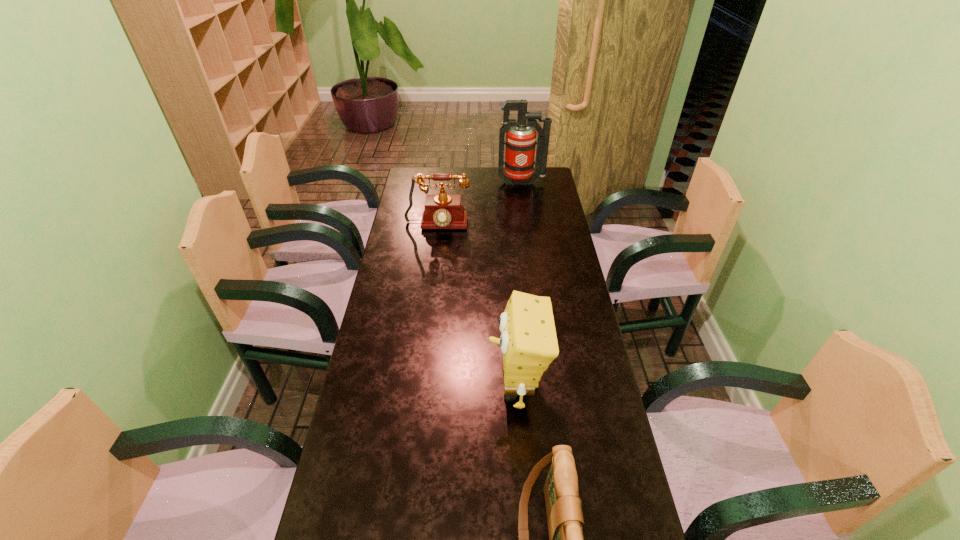
Locate an element on the screen. vacant region between the leftmost object and the tallest object is located at coordinates (479, 205).

In order to click on vacant area that lies between the farthest object and the sponge in this screenshot , I will do `click(519, 284)`.

Where is `free space between the fire extinguisher and the third tallest object`? The width and height of the screenshot is (960, 540). free space between the fire extinguisher and the third tallest object is located at coordinates (479, 205).

In order to click on free point between the farthest object and the second tallest object in this screenshot , I will do `click(519, 284)`.

Where is `vacant area between the leftmost object and the tallest object`? This screenshot has width=960, height=540. vacant area between the leftmost object and the tallest object is located at coordinates (479, 205).

At what (x,y) coordinates should I click in order to perform the action: click on object that is the third closest one to the third shortest object. Please return your answer as a coordinate pair (x, y). The image size is (960, 540). Looking at the image, I should click on (520, 142).

Locate which object is the closest to the second tallest object. Please provide its 2D coordinates. Your answer should be formatted as a tuple, i.e. [(x, y)], where the tuple contains the x and y coordinates of a point satisfying the conditions above.

[(565, 521)]

Image resolution: width=960 pixels, height=540 pixels. Find the location of `free space in the image that satisfies the following two spatial constraints: 1. on the front label side of the fire extinguisher; 2. on the face of the sponge`. free space in the image that satisfies the following two spatial constraints: 1. on the front label side of the fire extinguisher; 2. on the face of the sponge is located at coordinates (549, 386).